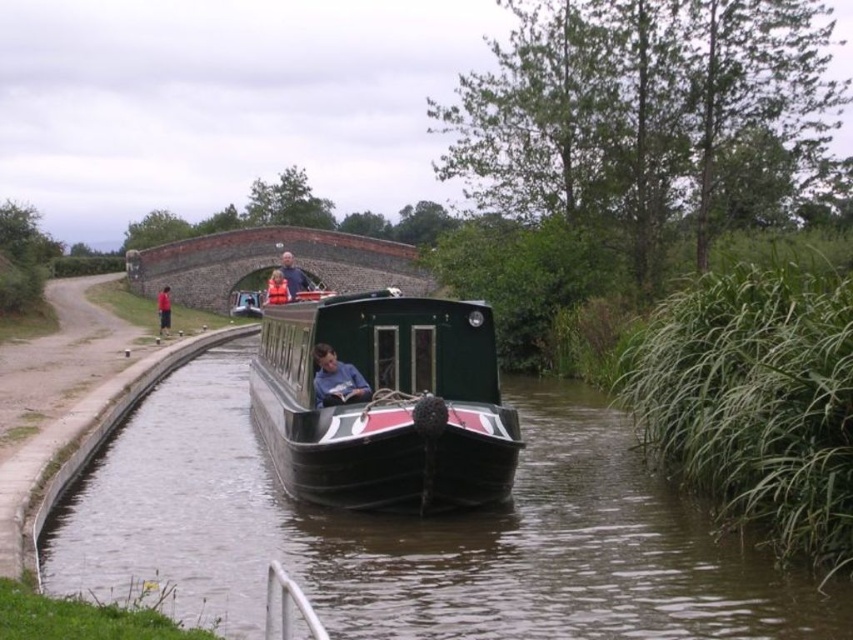
Who is more forward, (x=367, y=372) or (x=276, y=273)?

Point (x=367, y=372) is in front.

Who is lower down, green polished wood boat at center or orange fabric jacket at center?

Positioned lower is green polished wood boat at center.

Identify the location of green polished wood boat at center. The width and height of the screenshot is (853, 640). (386, 404).

Locate an element on the screen. This screenshot has height=640, width=853. green polished wood boat at center is located at coordinates (386, 404).

Is blue fabric shirt at center taller than dark blue shirt at center?

No, blue fabric shirt at center is not taller than dark blue shirt at center.

Is blue fabric shirt at center closer to the viewer compared to dark blue shirt at center?

Yes, blue fabric shirt at center is in front of dark blue shirt at center.

Is point (315, 404) less distant than point (294, 276)?

Yes, it is in front of point (294, 276).

Locate an element on the screen. blue fabric shirt at center is located at coordinates (335, 380).

Between point (645, 490) and point (326, 394), which one is positioned behind?

Point (645, 490)

Does green glossy boat at center have a lesser height compared to blue fabric shirt at center?

No.

What do you see at coordinates (421, 534) in the screenshot? This screenshot has width=853, height=640. I see `green glossy boat at center` at bounding box center [421, 534].

Where is `green glossy boat at center`? This screenshot has width=853, height=640. green glossy boat at center is located at coordinates (421, 534).